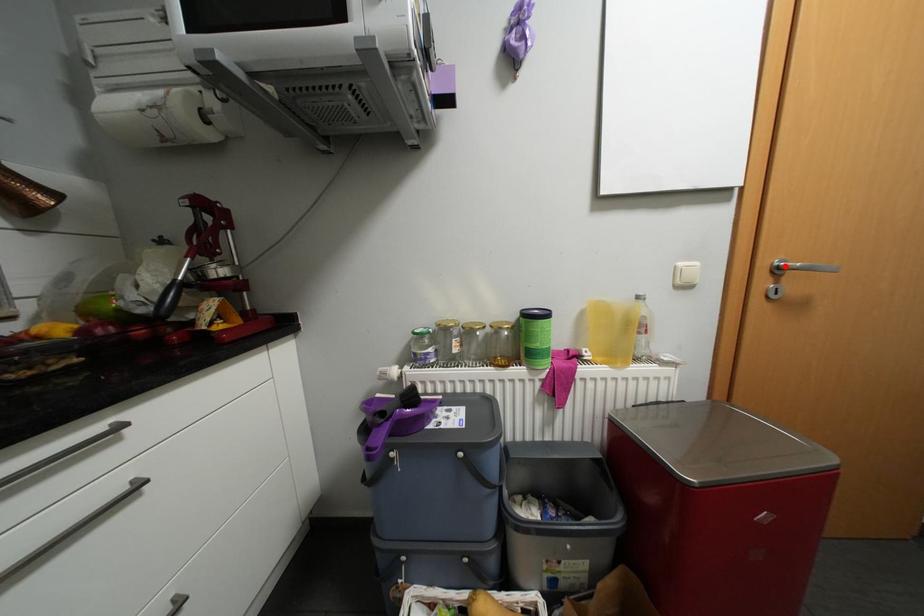
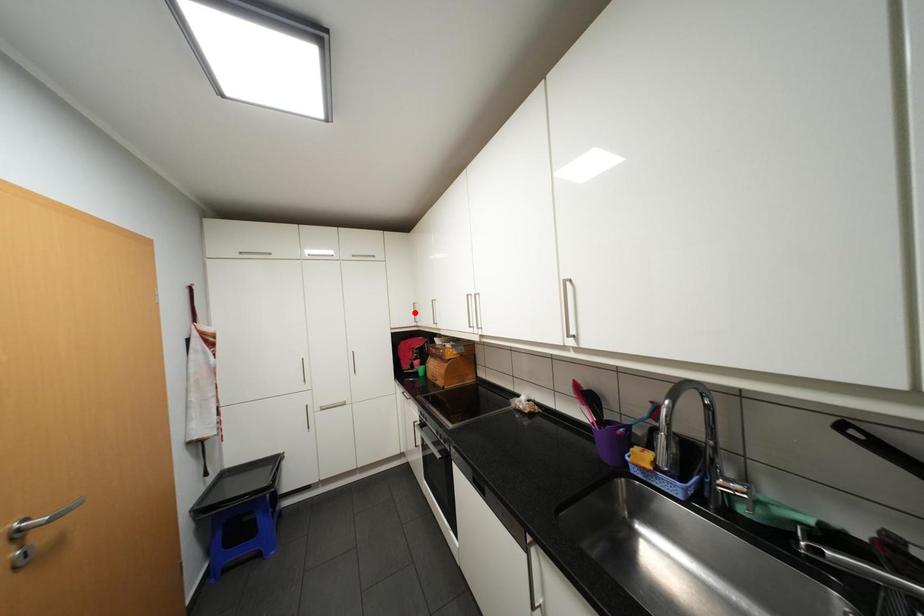
I am providing you with two images of the same scene from different viewpoints. A red point is marked on the first image and another point is marked on the second image. Is the red point in image1 aligned with the point shown in image2?

No